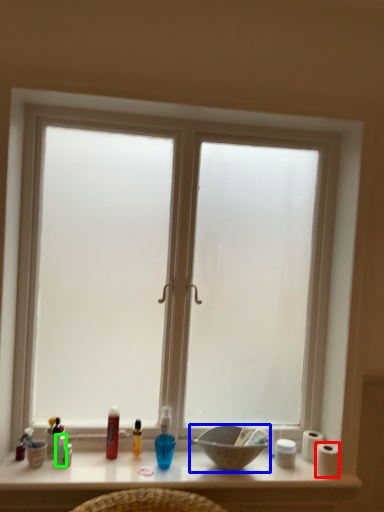
Question: Considering the real-world distances, which object is farthest from toilet paper (highlighted by a red box)? bowl (highlighted by a blue box) or toiletry (highlighted by a green box)?

Choices:
 (A) bowl
 (B) toiletry

Answer: (B)